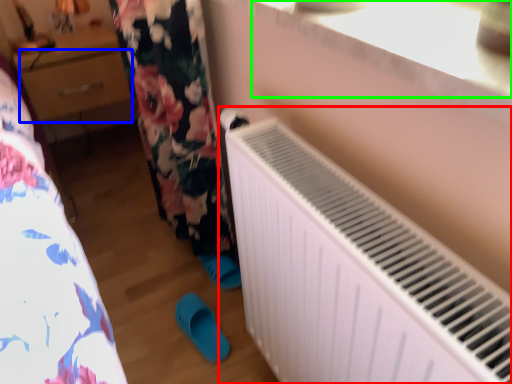
Question: Based on their relative distances, which object is nearer to radiator (highlighted by a red box)? Choose from drawer (highlighted by a blue box) and window sill (highlighted by a green box).

Choices:
 (A) drawer
 (B) window sill

Answer: (B)